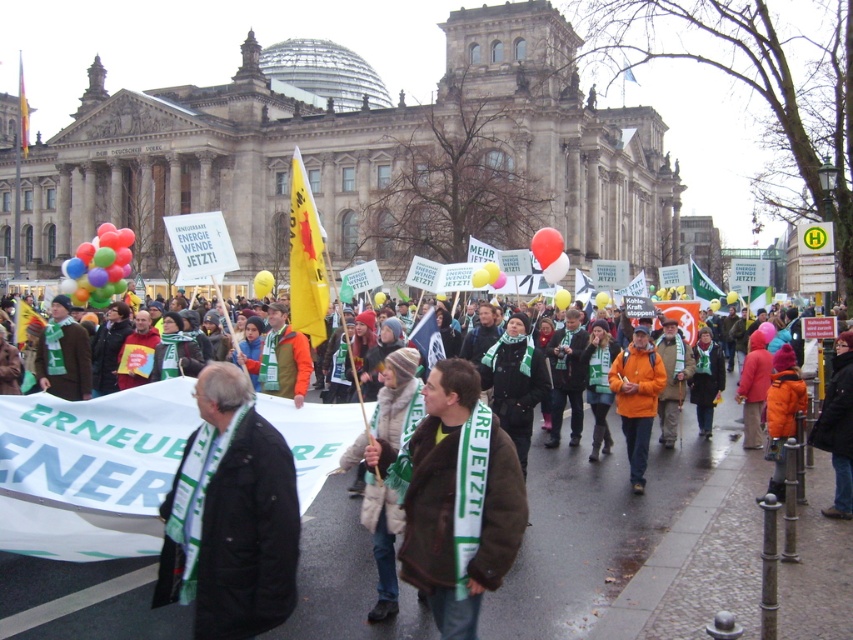
Question: Which object appears closest to the camera in this image?

Choices:
 (A) black fabric jacket at center
 (B) orange matte jacket at center
 (C) translucent red balloon at center

Answer: (A)

Question: Does orange fabric scarf at lower right appear on the right side of brown wool scarf at center?

Choices:
 (A) no
 (B) yes

Answer: (B)

Question: Which point is farther from the camera taking this photo?

Choices:
 (A) (369, 496)
 (B) (115, 237)

Answer: (B)

Question: In this image, where is black fabric jacket at center located relative to translucent red balloon at center?

Choices:
 (A) above
 (B) below

Answer: (B)

Question: Among these points, which one is nearest to the camera?

Choices:
 (A) (103, 276)
 (B) (283, 444)
 (C) (508, 524)

Answer: (C)

Question: Does green scarf at center have a greater width compared to multicolored balloons at left?

Choices:
 (A) no
 (B) yes

Answer: (A)